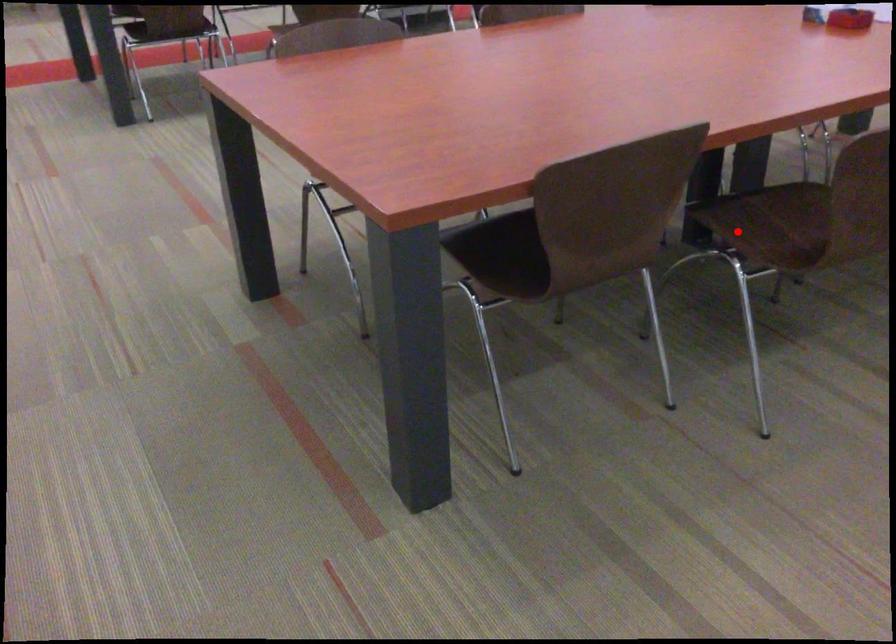
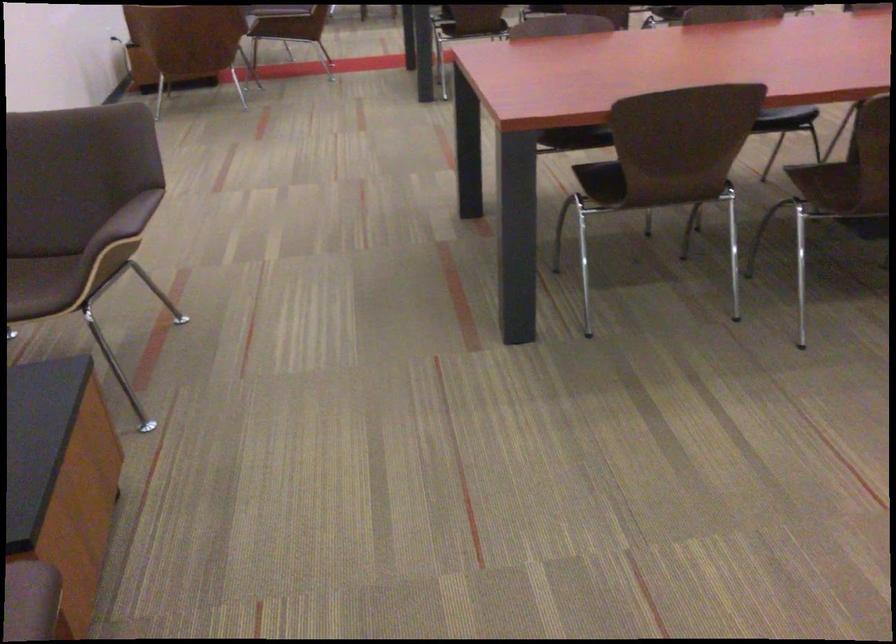
The point at the highlighted location is marked in the first image. Where is the corresponding point in the second image?

(819, 183)